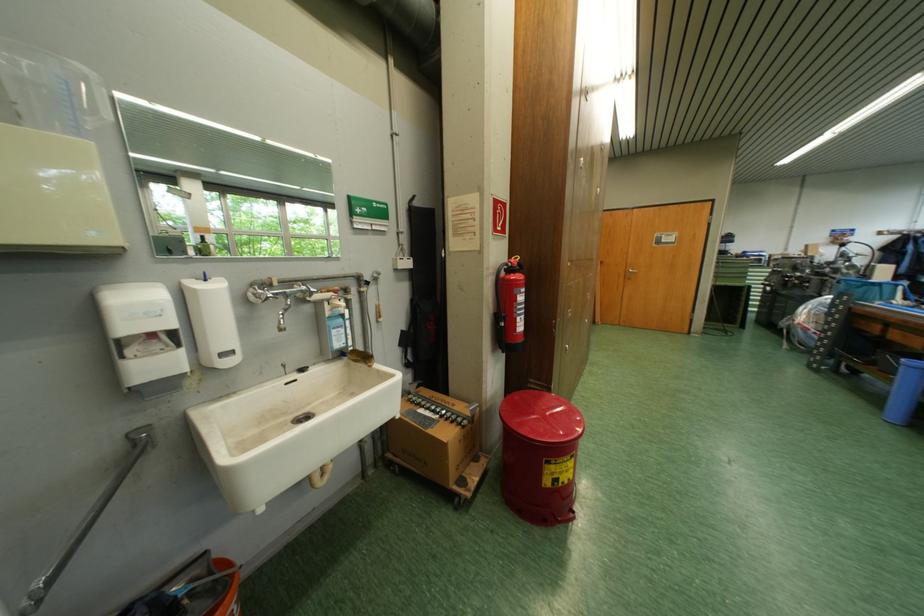
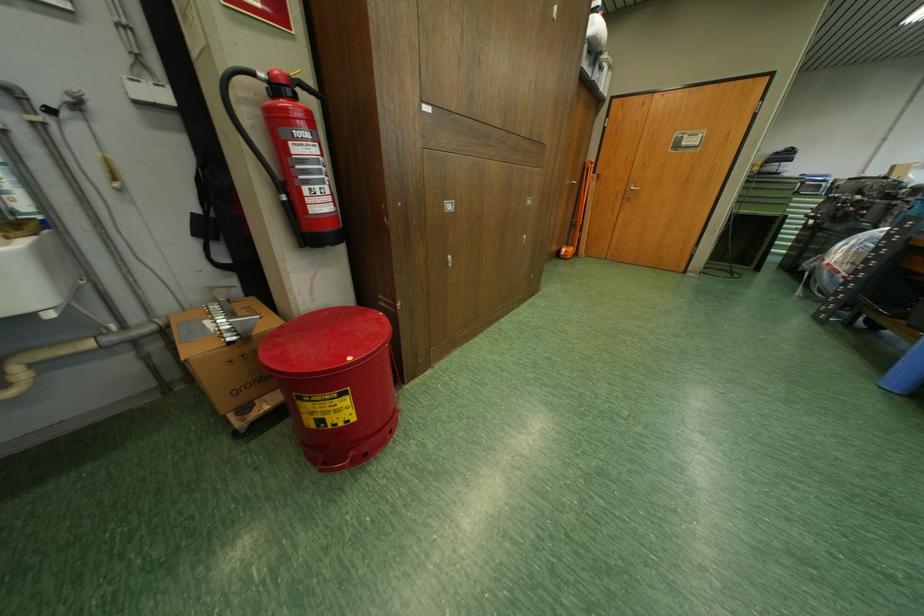
In the second image, find the point that corresponds to point 531,523 in the first image.

(314, 461)